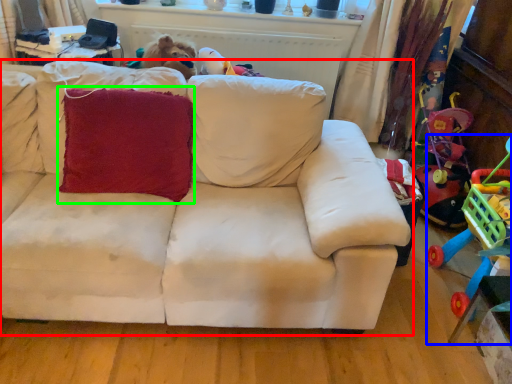
Question: Considering the real-world distances, which object is closest to studio couch (highlighted by a red box)? toy (highlighted by a blue box) or throw pillow (highlighted by a green box).

Choices:
 (A) toy
 (B) throw pillow

Answer: (B)